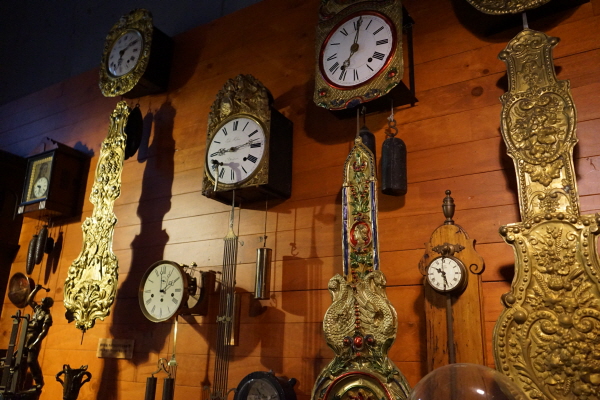
In order to click on clocks in this screenshot , I will do `click(130, 59)`, `click(44, 187)`, `click(162, 301)`, `click(236, 156)`, `click(356, 56)`, `click(441, 273)`, `click(500, 7)`, `click(263, 399)`.